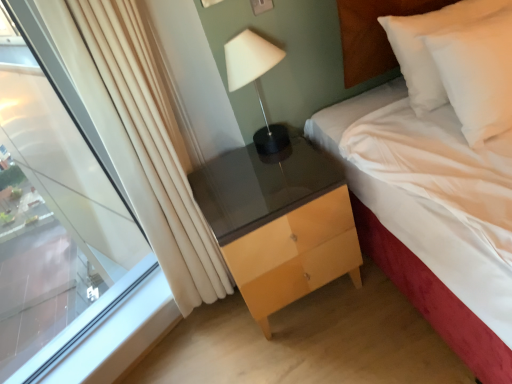
Question: Is white soft bed at center thinner than matte wood chest of drawers at center?

Choices:
 (A) no
 (B) yes

Answer: (A)

Question: Is the position of white soft bed at center more distant than that of matte wood chest of drawers at center?

Choices:
 (A) yes
 (B) no

Answer: (B)

Question: Could you tell me if white soft bed at center is facing matte wood chest of drawers at center?

Choices:
 (A) yes
 (B) no

Answer: (B)

Question: Can you confirm if white soft bed at center is smaller than matte wood chest of drawers at center?

Choices:
 (A) yes
 (B) no

Answer: (B)

Question: Is white soft bed at center bigger than matte wood chest of drawers at center?

Choices:
 (A) no
 (B) yes

Answer: (B)

Question: Does white soft bed at center appear on the left side of matte wood chest of drawers at center?

Choices:
 (A) yes
 (B) no

Answer: (B)

Question: From the image's perspective, is matte black lamp at upper center located beneath white soft pillow at upper right?

Choices:
 (A) no
 (B) yes

Answer: (B)

Question: Is matte black lamp at upper center not within white soft pillow at upper right?

Choices:
 (A) yes
 (B) no

Answer: (A)

Question: Can you confirm if matte black lamp at upper center is wider than white soft pillow at upper right?

Choices:
 (A) yes
 (B) no

Answer: (B)

Question: Are matte black lamp at upper center and white soft pillow at upper right beside each other?

Choices:
 (A) no
 (B) yes

Answer: (A)

Question: Considering the relative positions of matte black lamp at upper center and white soft pillow at upper right in the image provided, is matte black lamp at upper center to the left of white soft pillow at upper right from the viewer's perspective?

Choices:
 (A) yes
 (B) no

Answer: (A)

Question: Could you tell me if matte black lamp at upper center is turned towards white soft pillow at upper right?

Choices:
 (A) yes
 (B) no

Answer: (B)

Question: Would you say white soft pillow at upper right is outside transparent glass window at left?

Choices:
 (A) no
 (B) yes

Answer: (B)